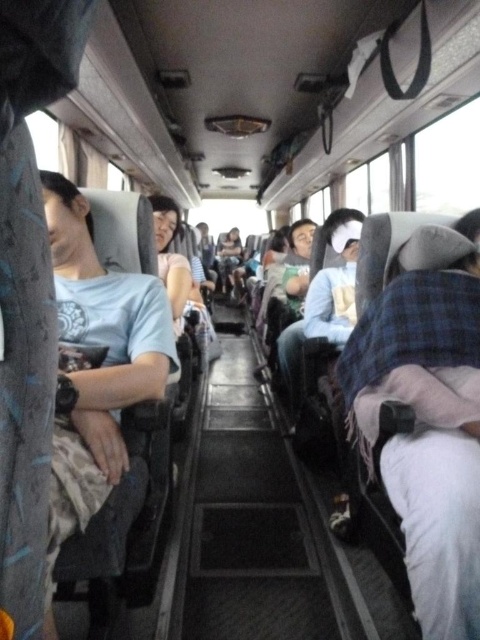
You are a passenger on a bus and want to place your light blue fabric pillow at center on your lap. However, there is a person wearing a matte gray shirt at left in front of you. Can you reach the pillow without moving the person?

The matte gray shirt at left is closer to the viewer than the light blue fabric pillow at center, so you cannot reach the light blue fabric pillow at center without moving the person wearing the matte gray shirt at left.

You are a passenger on a bus and want to nap using the light blue fabric pillow at center. The person wearing the matte gray shirt at left is sitting in the seat ahead of you. Can you reach the pillow from your current seat without leaving your seat?

The matte gray shirt at left is 1.54 meters away from the light blue fabric pillow at center. Since the distance between them is over a meter and a half, you likely cannot reach the pillow from your seat without moving.

You are a passenger on a bus and notice a person wearing a matte gray shirt at left. If you want to locate them quickly, where should you look?

You should look at point 0.562 on the x axis and point 0.217 on the y axis to locate the matte gray shirt at left.